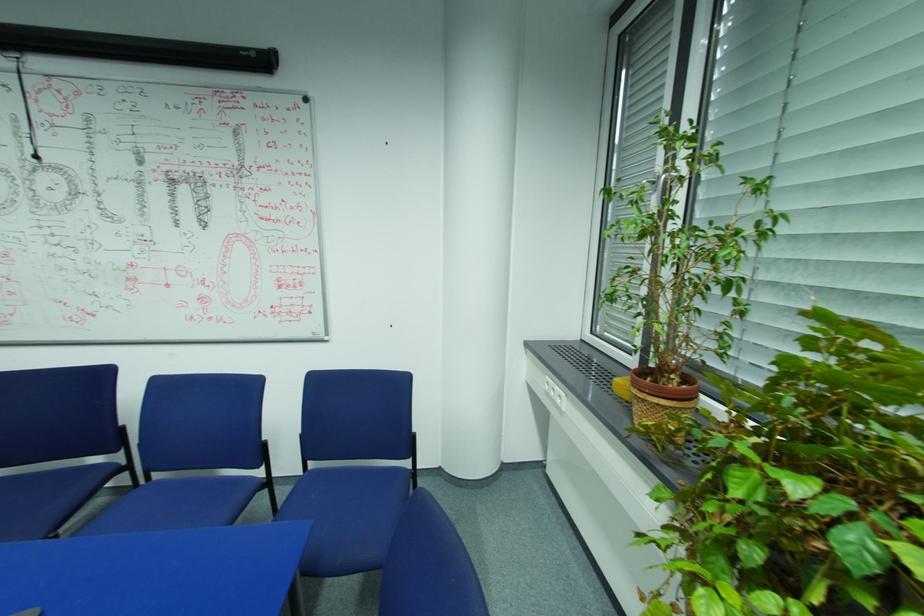
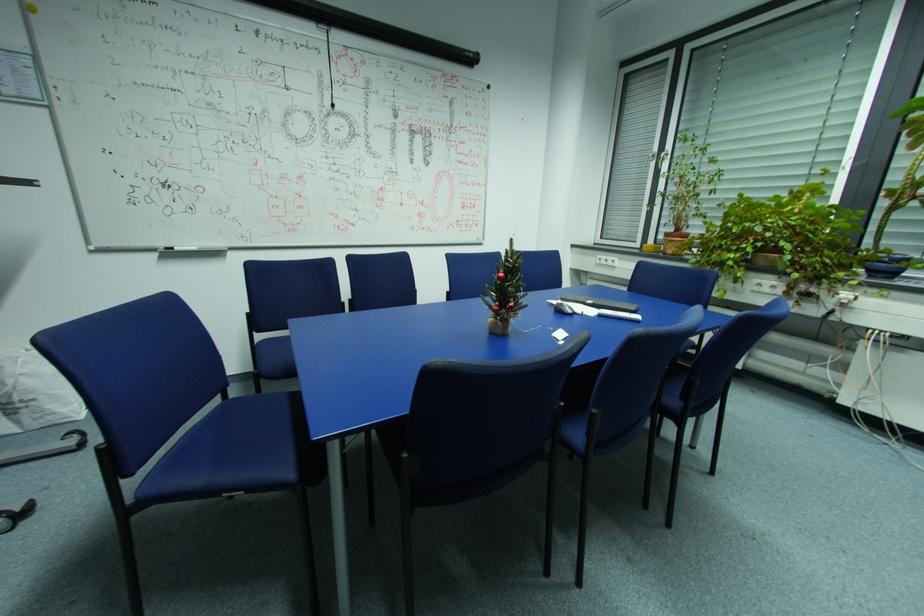
What movement of the cameraman would produce the second image?

The cameraman moved toward left, backward.